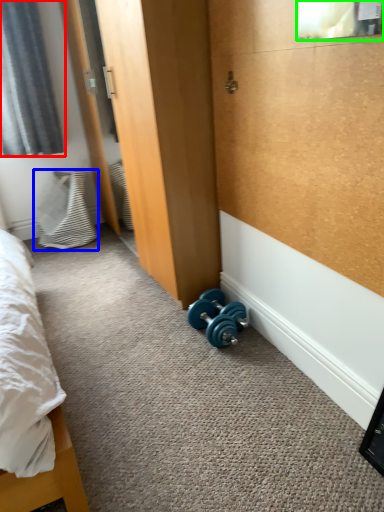
Question: Based on their relative distances, which object is nearer to curtain (highlighted by a red box)? Choose from pillow (highlighted by a blue box) and window screen (highlighted by a green box).

Choices:
 (A) pillow
 (B) window screen

Answer: (A)